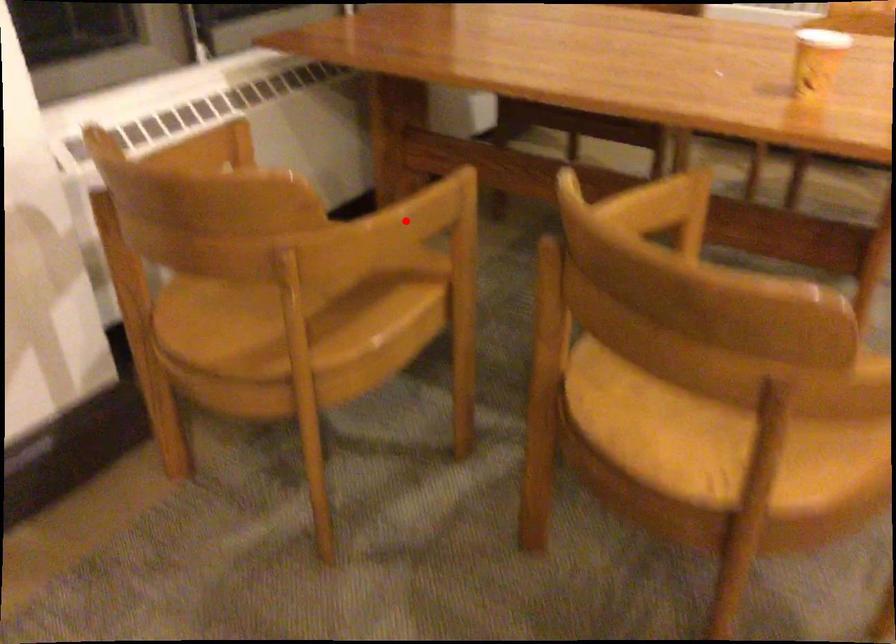
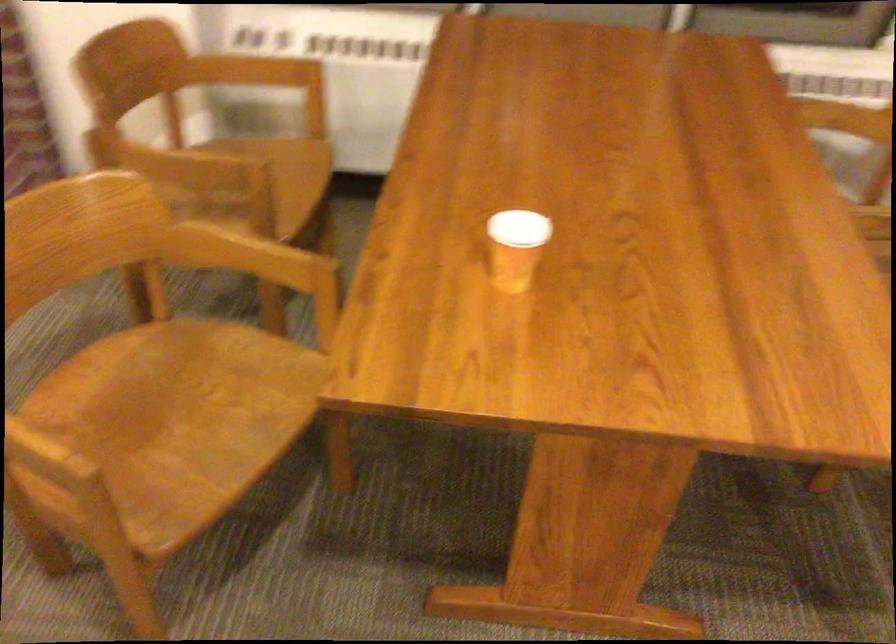
The point at the highlighted location is marked in the first image. Where is the corresponding point in the second image?

(169, 163)